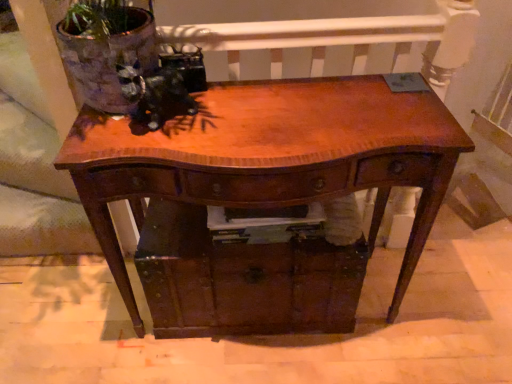
Question: In terms of height, does shiny brown wood table at center look taller or shorter compared to wooden drawer at center?

Choices:
 (A) tall
 (B) short

Answer: (A)

Question: Is shiny brown wood table at center in front of or behind wooden drawer at center in the image?

Choices:
 (A) behind
 (B) front

Answer: (B)

Question: Would you say shiny brown wood table at center is to the left or to the right of wooden drawer at center in the picture?

Choices:
 (A) left
 (B) right

Answer: (B)

Question: Considering the positions of wooden drawer at center and shiny brown wood table at center in the image, is wooden drawer at center taller or shorter than shiny brown wood table at center?

Choices:
 (A) tall
 (B) short

Answer: (B)

Question: From the image's perspective, relative to shiny brown wood table at center, is wooden drawer at center above or below?

Choices:
 (A) below
 (B) above

Answer: (A)

Question: Is wooden drawer at center to the left or to the right of shiny brown wood table at center in the image?

Choices:
 (A) right
 (B) left

Answer: (B)

Question: In terms of width, does wooden drawer at center look wider or thinner when compared to shiny brown wood table at center?

Choices:
 (A) thin
 (B) wide

Answer: (B)